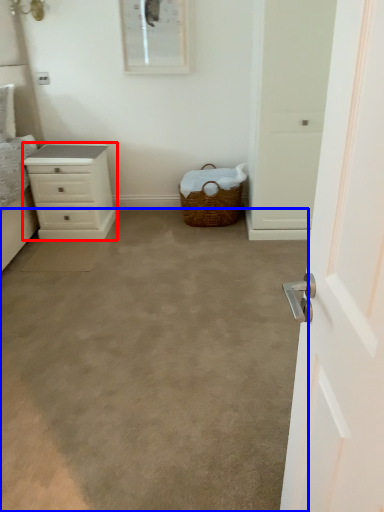
Question: Which of the following is the closest to the observer, chest of drawers (highlighted by a red box) or plain (highlighted by a blue box)?

Choices:
 (A) chest of drawers
 (B) plain

Answer: (B)